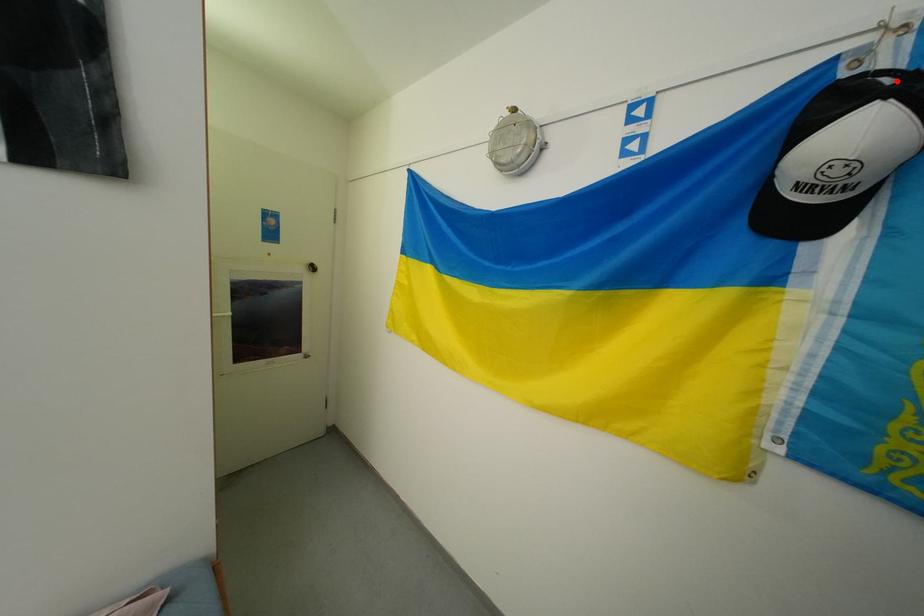
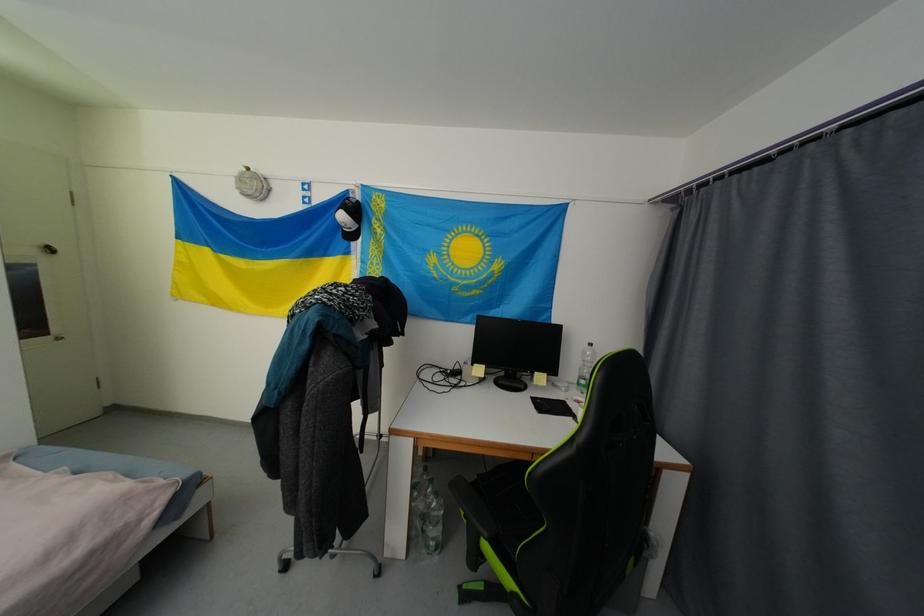
Where in the second image is the point corresponding to the highlighted location from the first image?

(359, 203)